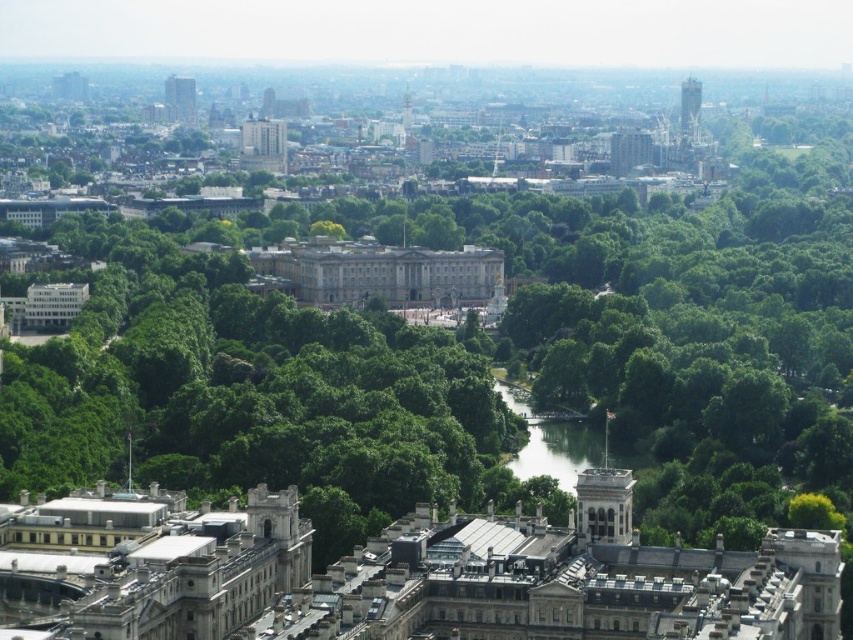
Question: Which point appears closest to the camera in this image?

Choices:
 (A) (590, 435)
 (B) (166, 328)

Answer: (A)

Question: Is green leafy trees at center below green grassy river at center?

Choices:
 (A) yes
 (B) no

Answer: (B)

Question: Which of the following is the closest to the observer?

Choices:
 (A) green grassy river at center
 (B) green leafy trees at center

Answer: (A)

Question: Does green leafy trees at center have a greater width compared to green grassy river at center?

Choices:
 (A) no
 (B) yes

Answer: (B)

Question: Which of the following is the farthest from the observer?

Choices:
 (A) green leafy trees at center
 (B) green grassy river at center

Answer: (A)

Question: Does green leafy trees at center have a lesser width compared to green grassy river at center?

Choices:
 (A) no
 (B) yes

Answer: (A)